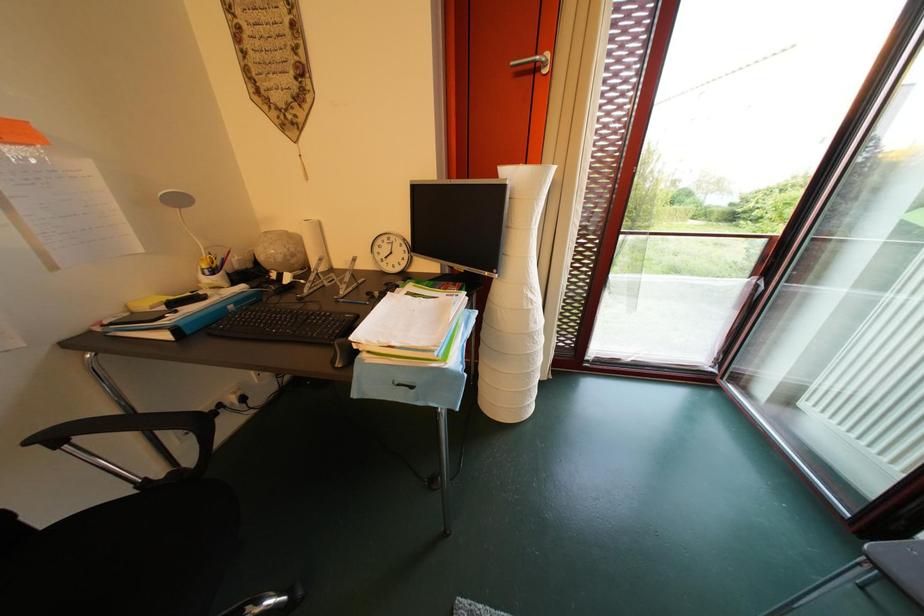
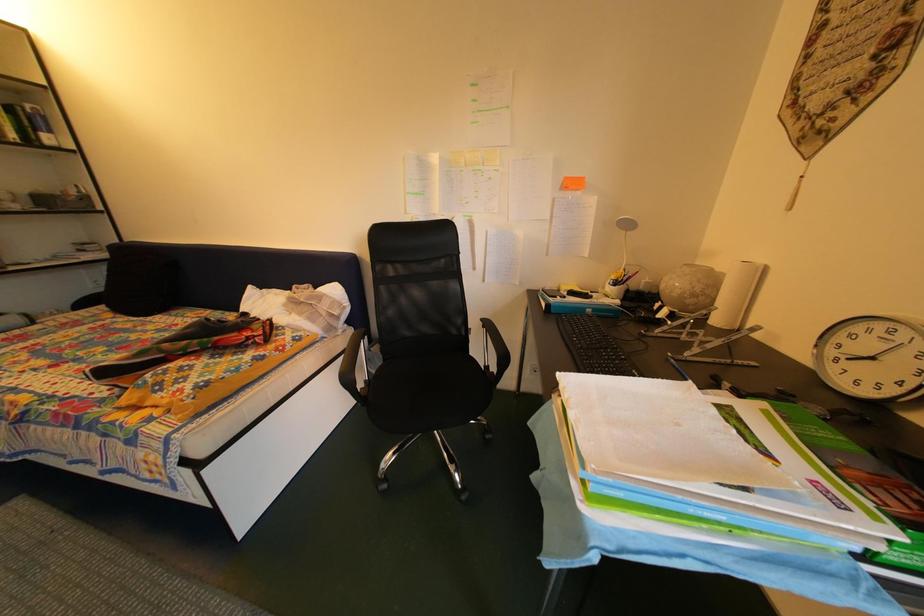
The first image is from the beginning of the video and the second image is from the end. How did the camera likely rotate when shooting the video?

The camera's rotation is toward left-down.